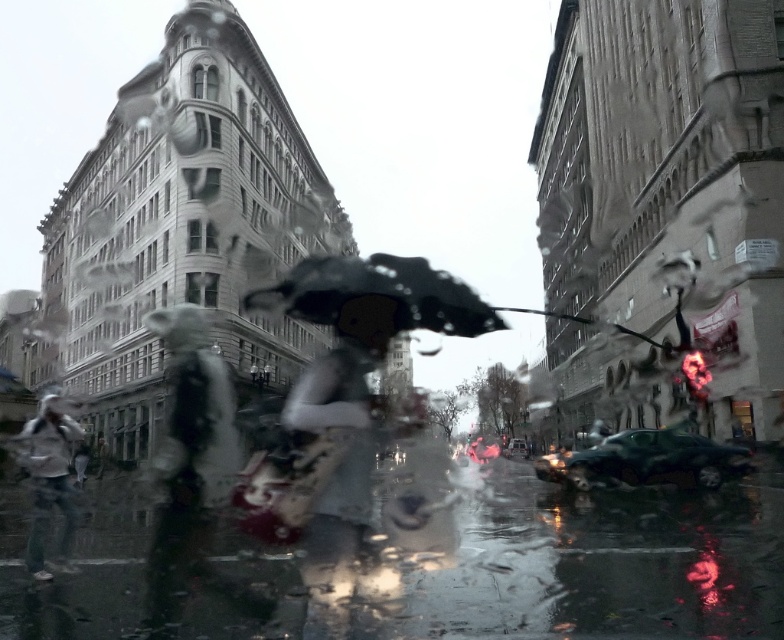
Question: Which of the following is the farthest from the observer?

Choices:
 (A) (22, 433)
 (B) (430, 273)
 (C) (354, 490)
 (D) (169, 408)

Answer: (D)

Question: Which is nearer to the matte black umbrella at center?

Choices:
 (A) dark gray fabric umbrella at center
 (B) white matte jacket at left

Answer: (B)

Question: Does dark gray fabric umbrella at center have a larger size compared to white matte jacket at left?

Choices:
 (A) yes
 (B) no

Answer: (B)

Question: Is matte black umbrella at center positioned in front of white matte jacket at left?

Choices:
 (A) no
 (B) yes

Answer: (B)

Question: Does matte black umbrella at center have a lesser width compared to white matte jacket at left?

Choices:
 (A) no
 (B) yes

Answer: (B)

Question: Among these points, which one is farthest from the camera?

Choices:
 (A) (380, 353)
 (B) (354, 308)
 (C) (44, 566)
 (D) (213, 397)

Answer: (D)